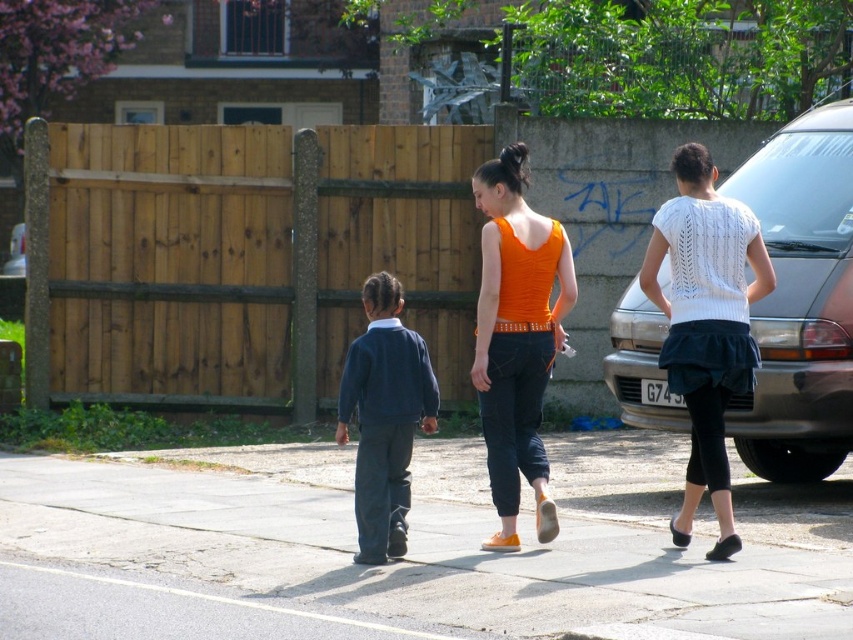
You are a delivery person carrying a large box that is 1.5 meters wide. You need to move along the gray concrete sidewalk at center while avoiding the white knitted sweater at upper right. Is the sidewalk wide enough for your box?

The gray concrete sidewalk at center has a lesser width compared to the white knitted sweater at upper right, which means the sidewalk is narrower than the sweater. Since your box is 1.5 meters wide, the sidewalk might not be wide enough. Check the actual width of the sidewalk before proceeding.

You are a delivery person with a cart that is 6 feet wide. You need to navigate between the metallic gray car at right and the orange matte tank top at center to reach the sidewalk. Can your cart fit through the space between them?

The metallic gray car at right and the orange matte tank top at center are 7.19 feet apart. Since your cart is 6 feet wide, there is enough space for it to fit through the gap between them.